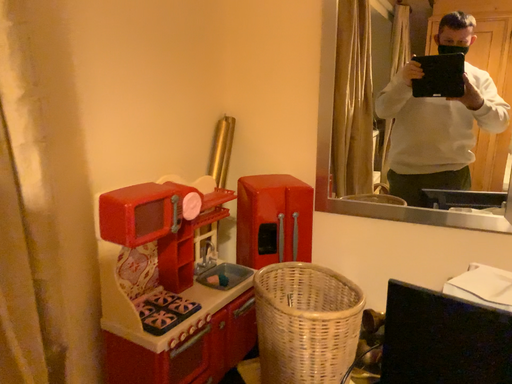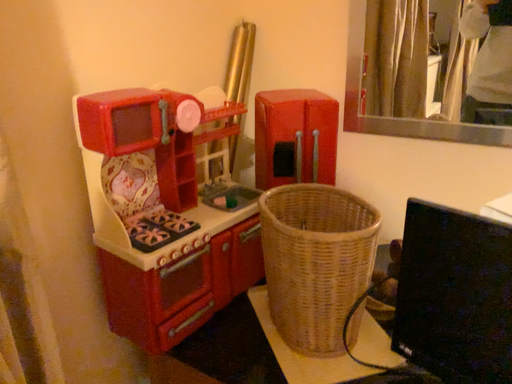
Question: How did the camera likely rotate when shooting the video?

Choices:
 (A) rotated right
 (B) rotated left

Answer: (B)